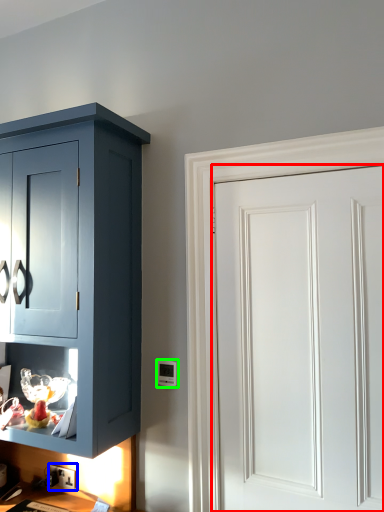
Question: Estimate the real-world distances between objects in this image. Which object is farther from door (highlighted by a red box), electric outlet (highlighted by a blue box) or light switch (highlighted by a green box)?

Choices:
 (A) electric outlet
 (B) light switch

Answer: (A)